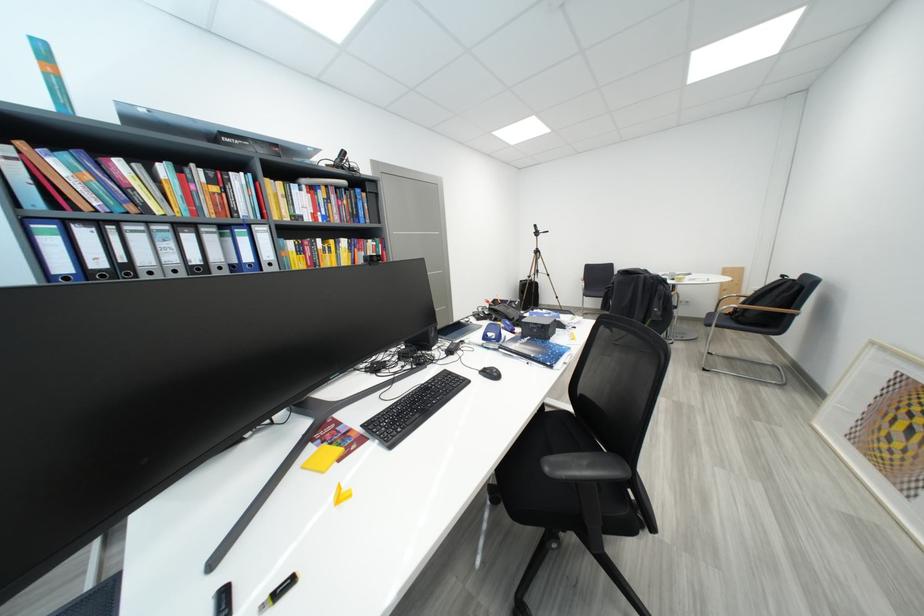
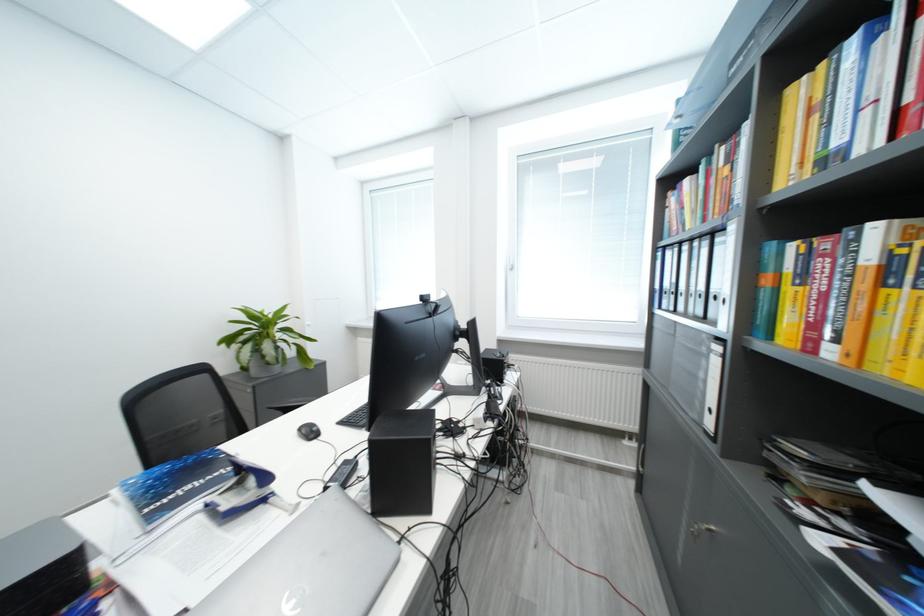
Question: I am providing you with two images of the same scene from different viewpoints. Which of the following objects are not visible in image2?

Choices:
 (A) ASUS cardboard box
 (B) black speaker
 (C) binder finger hole
 (D) hardcover book

Answer: (C)